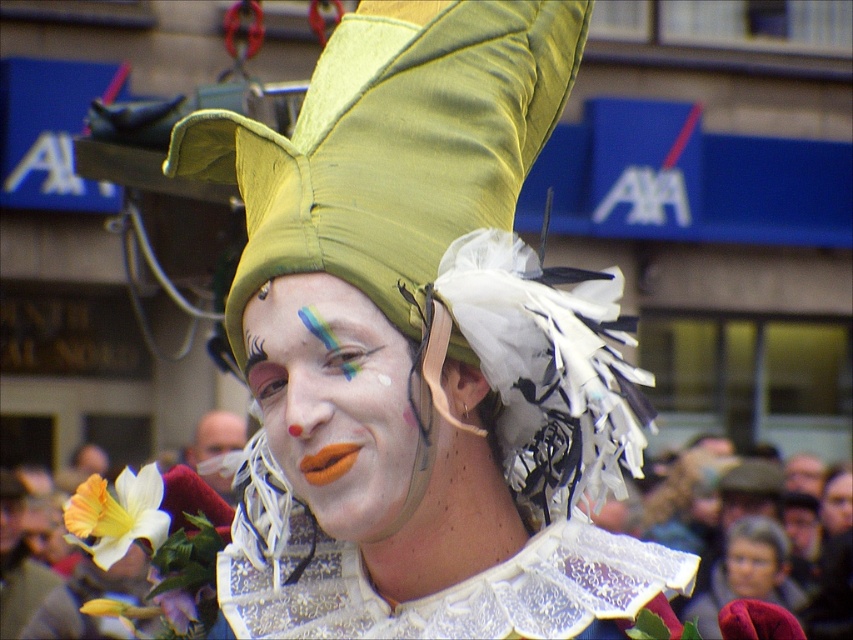
You are a photographer standing at a distance. You want to take a portrait of the person wearing the matte green hat at center and the smooth skin face at center. Given that the camera you are using has a maximum focus range of 10 meters, will you be able to capture both subjects clearly in focus?

The matte green hat at center is 19.81 meters away from smooth skin face at center. Since the camera can only focus up to 10 meters, the distance between them exceeds the maximum focus range. Therefore, you cannot capture both subjects clearly in focus.